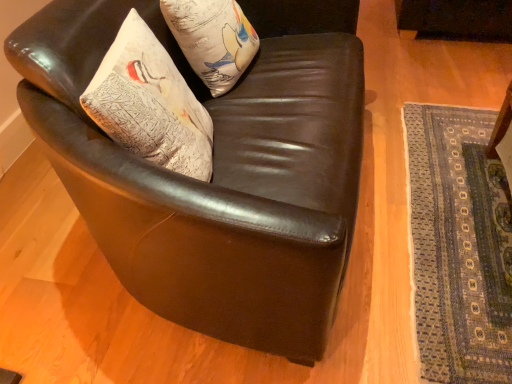
Where is `shiny brown leather armchair at center`? The image size is (512, 384). shiny brown leather armchair at center is located at coordinates (218, 171).

The width and height of the screenshot is (512, 384). What are the coordinates of `textured white pillow at upper left` in the screenshot? It's located at (212, 39).

This screenshot has height=384, width=512. I want to click on shiny brown leather armchair at center, so click(x=218, y=171).

In the image, is textured white pillow at upper left on the left side or the right side of shiny brown leather armchair at center?

Based on their positions, textured white pillow at upper left is located to the left of shiny brown leather armchair at center.

Which is in front, point (215, 63) or point (243, 7)?

The point (215, 63) is more forward.

Looking at this image, from a real-world perspective, who is located lower, textured white pillow at upper left or shiny brown leather armchair at center?

In real-world perspective, shiny brown leather armchair at center is lower.

Considering the sizes of objects textured white pillow at upper left and shiny brown leather armchair at center in the image provided, who is bigger, textured white pillow at upper left or shiny brown leather armchair at center?

shiny brown leather armchair at center is bigger.

Is textured white pillow at upper left facing away from blue woven mat at lower right?

No, textured white pillow at upper left is not facing away from blue woven mat at lower right.

From a real-world perspective, is textured white pillow at upper left over blue woven mat at lower right?

Correct, in the physical world, textured white pillow at upper left is higher than blue woven mat at lower right.

Which is in front, point (242, 32) or point (502, 207)?

The point (242, 32) is in front.

Would you say textured white pillow at upper left is a long distance from textured white pillow at upper left?

No, textured white pillow at upper left is in close proximity to textured white pillow at upper left.

Between textured white pillow at upper left and textured white pillow at upper left, which one appears on the left side from the viewer's perspective?

From the viewer's perspective, textured white pillow at upper left appears more on the left side.

From the image's perspective, is textured white pillow at upper left on textured white pillow at upper left?

No.

From a real-world perspective, between textured white pillow at upper left and textured white pillow at upper left, who is vertically higher?

textured white pillow at upper left is physically above.

Choose the correct answer: Is shiny brown leather armchair at center inside blue woven mat at lower right or outside it?

shiny brown leather armchair at center is outside blue woven mat at lower right.

Is shiny brown leather armchair at center wider or thinner than blue woven mat at lower right?

In the image, shiny brown leather armchair at center appears to be more narrow than blue woven mat at lower right.

Can you confirm if shiny brown leather armchair at center is positioned to the right of blue woven mat at lower right?

No.

Is shiny brown leather armchair at center facing away from blue woven mat at lower right?

No.

Identify the location of pillow above the shiny brown leather armchair at center (from the image's perspective). (212, 39).

Does shiny brown leather armchair at center have a greater width compared to textured white pillow at upper left?

Yes, shiny brown leather armchair at center is wider than textured white pillow at upper left.

In the scene shown: Is shiny brown leather armchair at center positioned far away from textured white pillow at upper left?

No, shiny brown leather armchair at center is not far from textured white pillow at upper left.

Between shiny brown leather armchair at center and textured white pillow at upper left, which one has more height?

Standing taller between the two is shiny brown leather armchair at center.

From a real-world perspective, is textured white pillow at upper left positioned under textured white pillow at upper left based on gravity?

Yes, from a real-world perspective, textured white pillow at upper left is below textured white pillow at upper left.

How different are the orientations of textured white pillow at upper left and textured white pillow at upper left in degrees?

The angle between the facing direction of textured white pillow at upper left and the facing direction of textured white pillow at upper left is 14.9 degrees.

Which of these two, textured white pillow at upper left or textured white pillow at upper left, is wider?

textured white pillow at upper left.

Is textured white pillow at upper left taller or shorter than textured white pillow at upper left?

In the image, textured white pillow at upper left appears to be shorter than textured white pillow at upper left.

Which point is more distant from viewer, (x=495, y=234) or (x=225, y=79)?

The point (x=495, y=234) is more distant.

From the image's perspective, who appears lower, blue woven mat at lower right or textured white pillow at upper left?

blue woven mat at lower right.

Considering the sizes of objects blue woven mat at lower right and textured white pillow at upper left in the image provided, who is wider, blue woven mat at lower right or textured white pillow at upper left?

blue woven mat at lower right.

Is blue woven mat at lower right not inside textured white pillow at upper left?

Yes, blue woven mat at lower right is outside of textured white pillow at upper left.

The image size is (512, 384). In order to click on pillow lying on the left of shiny brown leather armchair at center in this screenshot , I will do `click(212, 39)`.

What are the coordinates of `pillow above the blue woven mat at lower right (from a real-world perspective)` in the screenshot? It's located at (212, 39).

Based on their spatial positions, is textured white pillow at upper left or blue woven mat at lower right closer to textured white pillow at upper left?

The object closer to textured white pillow at upper left is textured white pillow at upper left.

Estimate the real-world distances between objects in this image. Which object is further from shiny brown leather armchair at center, textured white pillow at upper left or textured white pillow at upper left?

Among the two, textured white pillow at upper left is located further to shiny brown leather armchair at center.

Based on their spatial positions, is textured white pillow at upper left or shiny brown leather armchair at center further from textured white pillow at upper left?

shiny brown leather armchair at center lies further to textured white pillow at upper left than the other object.

Based on their spatial positions, is textured white pillow at upper left or blue woven mat at lower right closer to shiny brown leather armchair at center?

The object closer to shiny brown leather armchair at center is textured white pillow at upper left.

Looking at the image, which one is located closer to shiny brown leather armchair at center, textured white pillow at upper left or textured white pillow at upper left?

textured white pillow at upper left lies closer to shiny brown leather armchair at center than the other object.

Considering their positions, is blue woven mat at lower right positioned further to textured white pillow at upper left than textured white pillow at upper left?

blue woven mat at lower right is positioned further to the anchor textured white pillow at upper left.

Considering their positions, is blue woven mat at lower right positioned closer to textured white pillow at upper left than shiny brown leather armchair at center?

shiny brown leather armchair at center is positioned closer to the anchor textured white pillow at upper left.

Estimate the real-world distances between objects in this image. Which object is closer to shiny brown leather armchair at center, blue woven mat at lower right or textured white pillow at upper left?

Among the two, textured white pillow at upper left is located nearer to shiny brown leather armchair at center.

Locate an element on the screen. The width and height of the screenshot is (512, 384). pillow located between textured white pillow at upper left and blue woven mat at lower right in the left-right direction is located at coordinates (212, 39).

Identify the location of chair between textured white pillow at upper left and blue woven mat at lower right in the horizontal direction. This screenshot has height=384, width=512. (218, 171).

Where is `throw pillow between shiny brown leather armchair at center and textured white pillow at upper left in the front-back direction`? throw pillow between shiny brown leather armchair at center and textured white pillow at upper left in the front-back direction is located at coordinates (150, 104).

Image resolution: width=512 pixels, height=384 pixels. I want to click on chair located between textured white pillow at upper left and blue woven mat at lower right in the left-right direction, so click(218, 171).